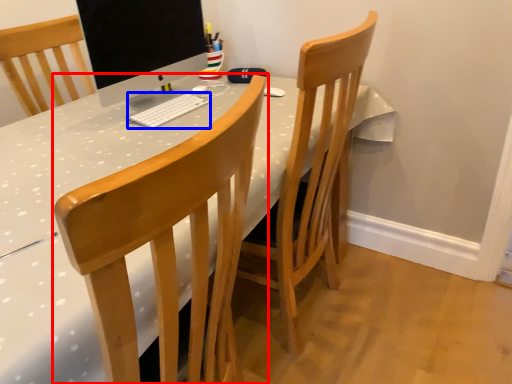
Question: Which object appears closest to the camera in this image, chair (highlighted by a red box) or computer keyboard (highlighted by a blue box)?

Choices:
 (A) chair
 (B) computer keyboard

Answer: (A)